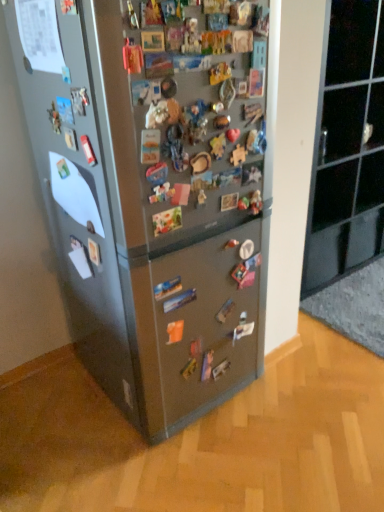
Question: Considering the relative sizes of black glass cabinet at upper right and satin silver fridge at center in the image provided, is black glass cabinet at upper right thinner than satin silver fridge at center?

Choices:
 (A) yes
 (B) no

Answer: (A)

Question: Considering the relative sizes of black glass cabinet at upper right and satin silver fridge at center in the image provided, is black glass cabinet at upper right smaller than satin silver fridge at center?

Choices:
 (A) yes
 (B) no

Answer: (A)

Question: Is black glass cabinet at upper right turned away from satin silver fridge at center?

Choices:
 (A) yes
 (B) no

Answer: (B)

Question: Is black glass cabinet at upper right closer to the viewer compared to satin silver fridge at center?

Choices:
 (A) no
 (B) yes

Answer: (A)

Question: Can you confirm if black glass cabinet at upper right is wider than satin silver fridge at center?

Choices:
 (A) no
 (B) yes

Answer: (A)

Question: Is black glass cabinet at upper right far from satin silver fridge at center?

Choices:
 (A) no
 (B) yes

Answer: (B)

Question: Are satin silver fridge at center and black glass cabinet at upper right located far from each other?

Choices:
 (A) yes
 (B) no

Answer: (A)

Question: Considering the relative positions of satin silver fridge at center and black glass cabinet at upper right in the image provided, is satin silver fridge at center to the left of black glass cabinet at upper right from the viewer's perspective?

Choices:
 (A) no
 (B) yes

Answer: (B)

Question: From the image's perspective, does satin silver fridge at center appear higher than black glass cabinet at upper right?

Choices:
 (A) no
 (B) yes

Answer: (A)

Question: Is satin silver fridge at center completely or partially outside of black glass cabinet at upper right?

Choices:
 (A) yes
 (B) no

Answer: (A)

Question: Does satin silver fridge at center have a larger size compared to black glass cabinet at upper right?

Choices:
 (A) no
 (B) yes

Answer: (B)

Question: Is the position of satin silver fridge at center more distant than that of black glass cabinet at upper right?

Choices:
 (A) yes
 (B) no

Answer: (B)

Question: From a real-world perspective, is satin silver fridge at center above or below black glass cabinet at upper right?

Choices:
 (A) below
 (B) above

Answer: (B)